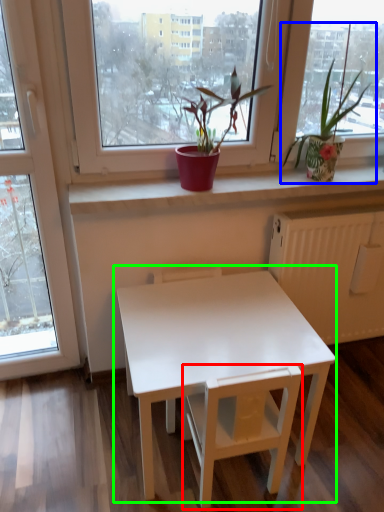
Question: Which object is the farthest from armchair (highlighted by a red box)? Choose among these: houseplant (highlighted by a blue box) or table (highlighted by a green box).

Choices:
 (A) houseplant
 (B) table

Answer: (A)